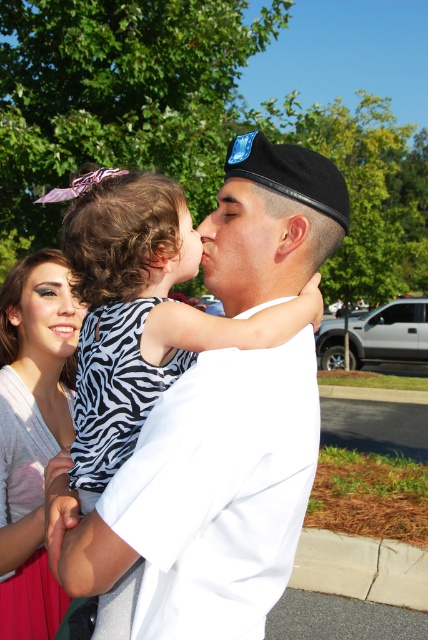
Can you confirm if white uniform at center is thinner than matte black eye at upper left?

In fact, white uniform at center might be wider than matte black eye at upper left.

Does white uniform at center come in front of matte black eye at upper left?

Yes.

Does point (130, 432) lie in front of point (20, 298)?

Yes, point (130, 432) is in front of point (20, 298).

You are a GUI agent. You are given a task and a screenshot of the screen. Output one action in this format:
    pyautogui.click(x=<x>, y=<y>)
    Task: Click on the white uniform at center
    
    Given the screenshot: What is the action you would take?
    pyautogui.click(x=113, y=392)

Does white cotton shirt at center have a larger size compared to white uniform at center?

Indeed, white cotton shirt at center has a larger size compared to white uniform at center.

Who is shorter, white cotton shirt at center or white uniform at center?

With less height is white cotton shirt at center.

Is point (211, 358) positioned before point (166, 385)?

That is True.

Locate an element on the screen. This screenshot has width=428, height=640. white cotton shirt at center is located at coordinates (214, 497).

This screenshot has height=640, width=428. I want to click on matte white sweater at center, so click(x=42, y=428).

Between point (11, 563) and point (198, 227), which one is positioned in front?

Point (11, 563) is more forward.

Where is `matte white sweater at center`? matte white sweater at center is located at coordinates click(x=42, y=428).